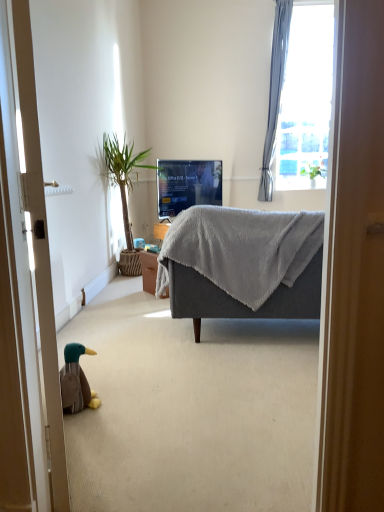
What are the coordinates of `vacant space behind brown plush duck at lower left` in the screenshot? It's located at (104, 381).